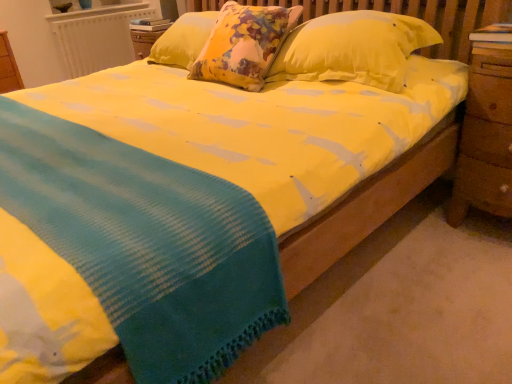
Question: Can yellow fabric pillow at center be found inside yellow cotton blanket at center?

Choices:
 (A) no
 (B) yes

Answer: (A)

Question: Is yellow cotton blanket at center at the left side of yellow fabric pillow at center?

Choices:
 (A) no
 (B) yes

Answer: (B)

Question: From the image's perspective, is yellow cotton blanket at center located beneath yellow fabric pillow at center?

Choices:
 (A) yes
 (B) no

Answer: (A)

Question: Is yellow cotton blanket at center touching yellow fabric pillow at center?

Choices:
 (A) no
 (B) yes

Answer: (A)

Question: Is yellow cotton blanket at center positioned in front of yellow fabric pillow at center?

Choices:
 (A) no
 (B) yes

Answer: (B)

Question: Relative to yellow cotton blanket at center, is yellow fabric pillow at center in front or behind?

Choices:
 (A) front
 (B) behind

Answer: (B)

Question: Based on their sizes in the image, would you say yellow fabric pillow at center is bigger or smaller than yellow cotton blanket at center?

Choices:
 (A) small
 (B) big

Answer: (A)

Question: Is yellow fabric pillow at center wider or thinner than yellow cotton blanket at center?

Choices:
 (A) thin
 (B) wide

Answer: (A)

Question: From a real-world perspective, is yellow fabric pillow at center positioned above or below yellow cotton blanket at center?

Choices:
 (A) above
 (B) below

Answer: (A)

Question: Is point pyautogui.click(x=459, y=160) closer or farther from the camera than point pyautogui.click(x=81, y=49)?

Choices:
 (A) closer
 (B) farther

Answer: (A)

Question: From a real-world perspective, is wooden at right positioned above or below white textured radiator at upper left?

Choices:
 (A) below
 (B) above

Answer: (A)

Question: Considering the positions of wooden at right and white textured radiator at upper left in the image, is wooden at right wider or thinner than white textured radiator at upper left?

Choices:
 (A) thin
 (B) wide

Answer: (B)

Question: Looking at the image, does wooden at right seem bigger or smaller compared to white textured radiator at upper left?

Choices:
 (A) small
 (B) big

Answer: (B)

Question: Considering their positions, is yellow cotton blanket at center located in front of or behind yellow fabric pillow at center?

Choices:
 (A) behind
 (B) front

Answer: (B)

Question: Looking at their shapes, would you say yellow cotton blanket at center is wider or thinner than yellow fabric pillow at center?

Choices:
 (A) wide
 (B) thin

Answer: (A)